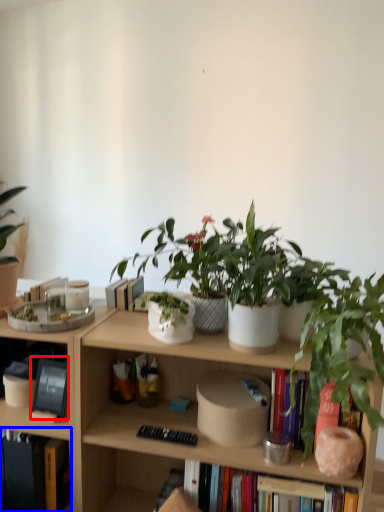
Question: Which object appears closest to the camera in this image, book (highlighted by a red box) or book (highlighted by a blue box)?

Choices:
 (A) book
 (B) book

Answer: (B)